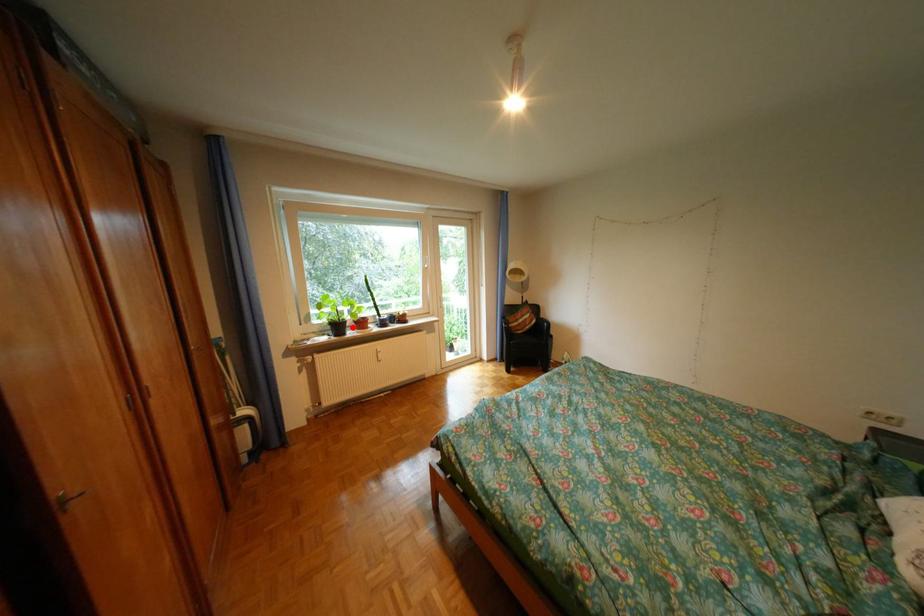
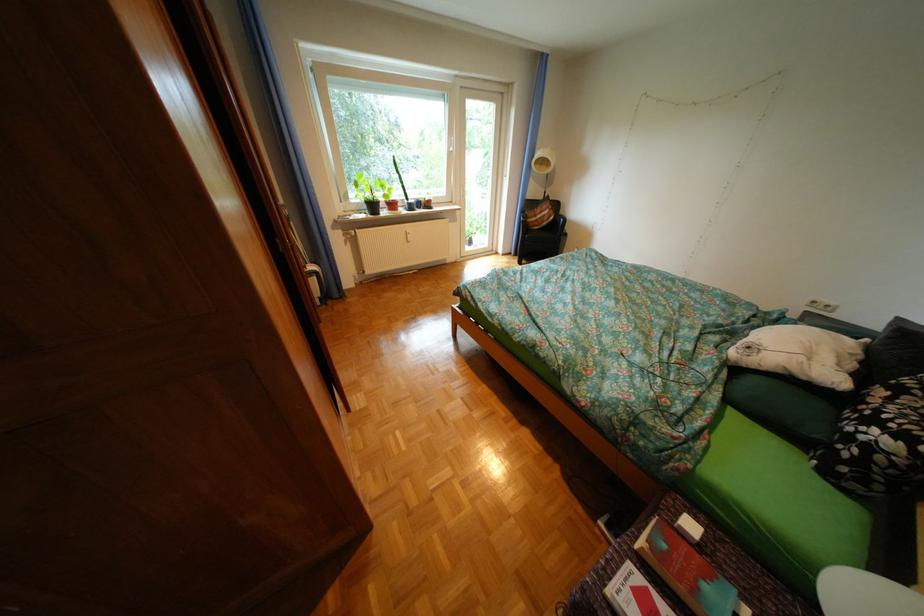
Find the pixel in the second image that matches the highlighted location in the first image.

(387, 207)